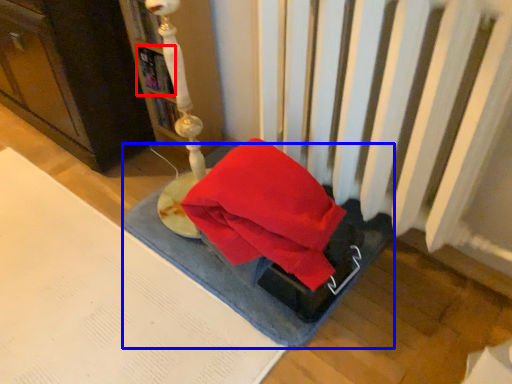
Question: Which object is further to the camera taking this photo, book (highlighted by a red box) or yoga mat (highlighted by a blue box)?

Choices:
 (A) book
 (B) yoga mat

Answer: (A)